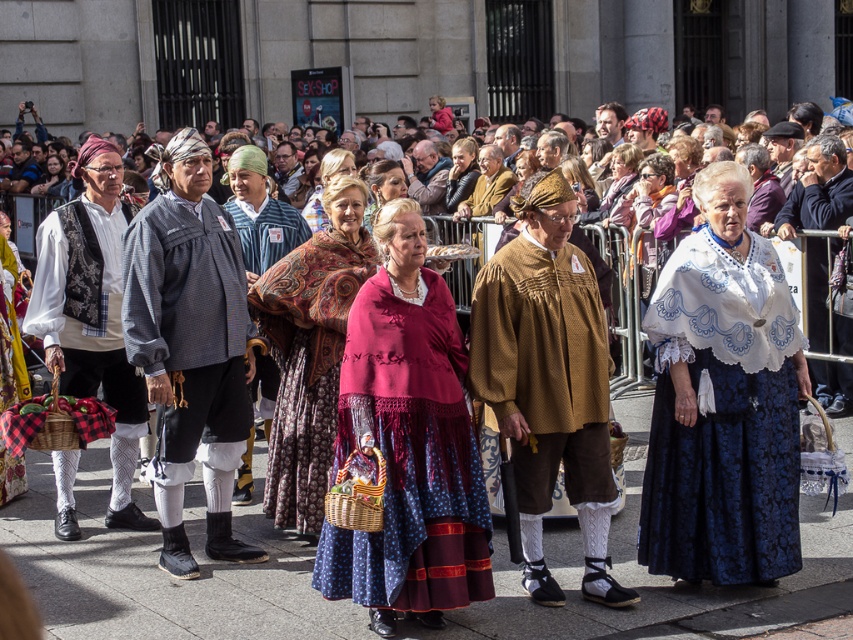
Question: Which object is the closest to the matte black headscarf at upper left?

Choices:
 (A) blue woven shirt at center
 (B) velvet floral dress at center
 (C) knitted wool shawl at center
 (D) brown textured robe at center

Answer: (A)

Question: Which object is farther from the camera taking this photo?

Choices:
 (A) knitted wool shawl at center
 (B) matte black headscarf at upper left

Answer: (B)

Question: Among these points, which one is farthest from the camera?

Choices:
 (A) (57, 161)
 (B) (437, 376)

Answer: (A)

Question: Can you confirm if knitted wool shawl at center is positioned to the right of velvet floral dress at center?

Choices:
 (A) no
 (B) yes

Answer: (B)

Question: Is blue woven shirt at center to the left of velvet floral dress at center from the viewer's perspective?

Choices:
 (A) yes
 (B) no

Answer: (A)

Question: Does blue damask skirt at center have a lesser width compared to blue woven shirt at center?

Choices:
 (A) yes
 (B) no

Answer: (B)